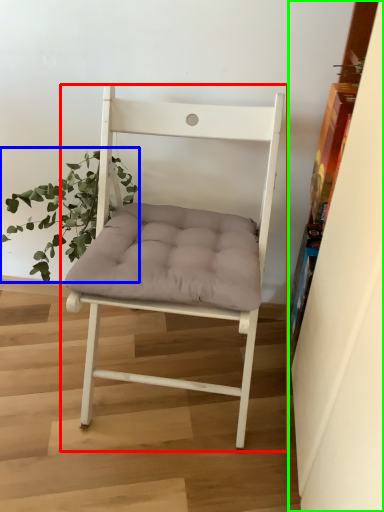
Question: Considering the real-world distances, which object is farthest from chair (highlighted by a red box)? houseplant (highlighted by a blue box) or shelf (highlighted by a green box)?

Choices:
 (A) houseplant
 (B) shelf

Answer: (B)